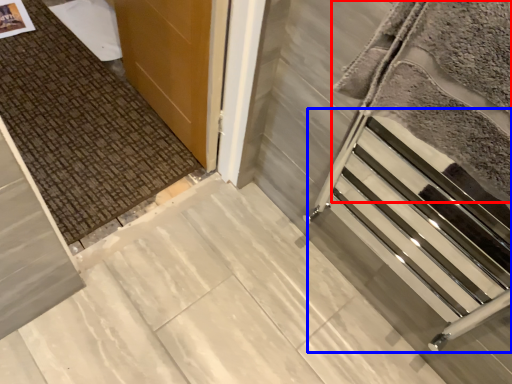
Question: Which object is closer to the camera taking this photo, blanket (highlighted by a red box) or stairwell (highlighted by a blue box)?

Choices:
 (A) blanket
 (B) stairwell

Answer: (A)